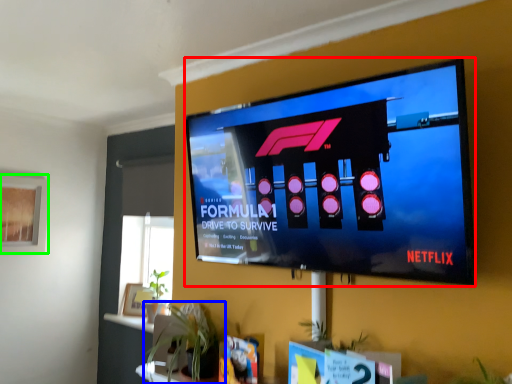
Question: Which object is the closest to the television (highlighted by a red box)? Choose among these: houseplant (highlighted by a blue box) or window screen (highlighted by a green box).

Choices:
 (A) houseplant
 (B) window screen

Answer: (A)